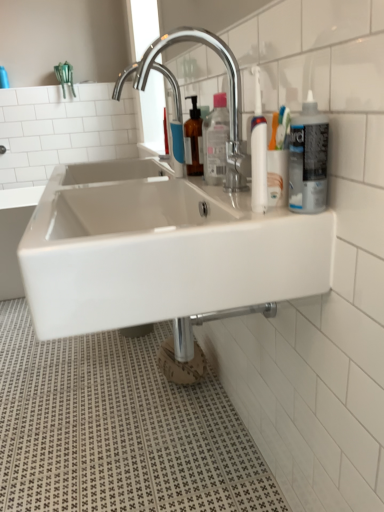
Describe the element at coordinates (152, 112) in the screenshot. The width and height of the screenshot is (384, 512). I see `clear glass window screen at upper center` at that location.

Measure the distance between clear glass window screen at upper center and camera.

1.78 meters.

This screenshot has width=384, height=512. In order to click on clear glass window screen at upper center in this screenshot , I will do `click(152, 112)`.

Locate an element on the screen. clear glass window screen at upper center is located at coordinates (152, 112).